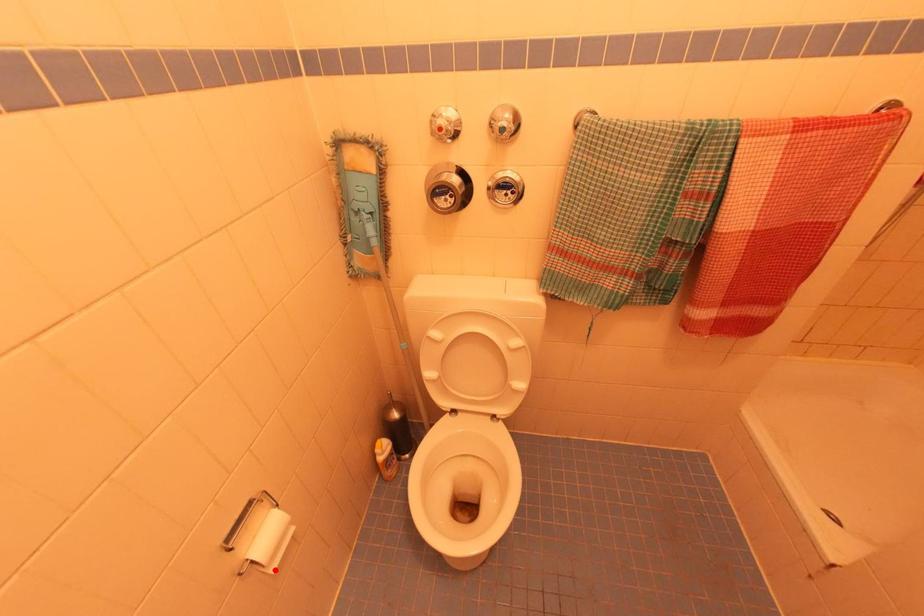
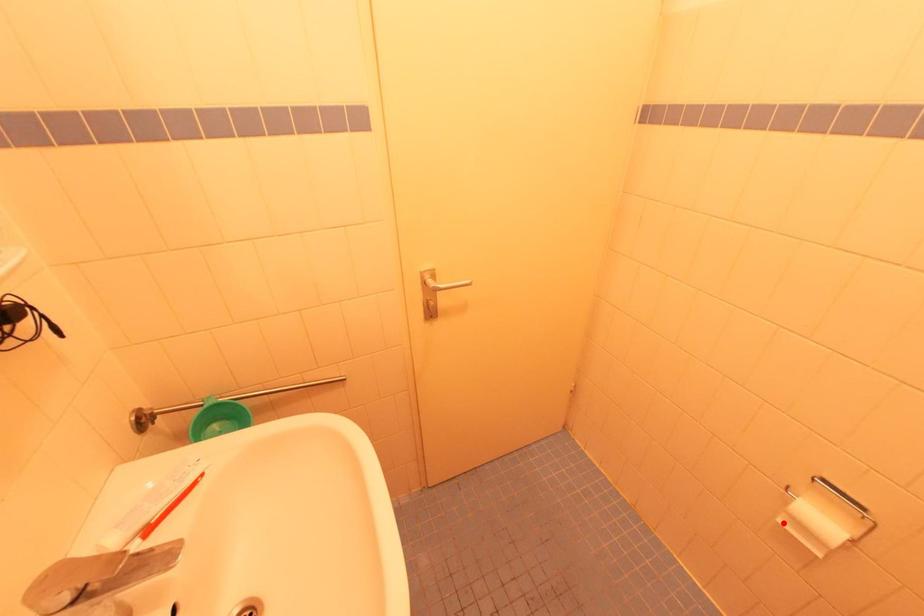
I am providing you with two images of the same scene from different viewpoints. A red point is marked on the first image and another point is marked on the second image. Is the red point in image1 aligned with the point shown in image2?

Yes